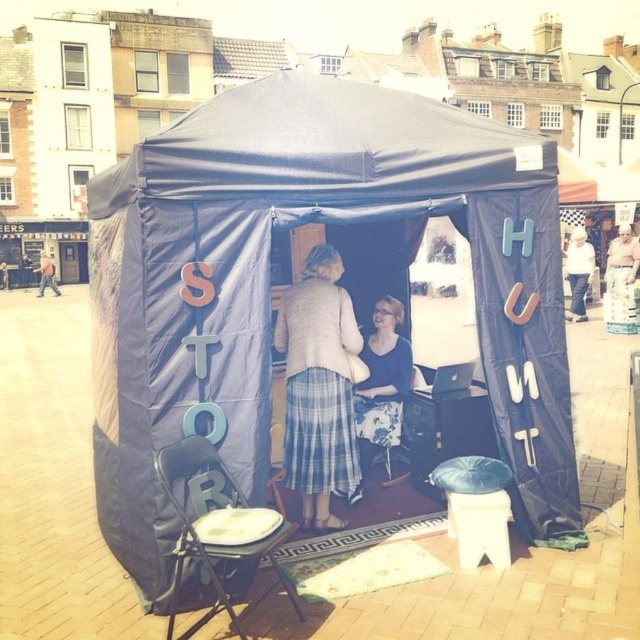
Question: From the image, what is the correct spatial relationship of dark blue leather stool at center in relation to matte black jacket at left?

Choices:
 (A) left
 (B) right

Answer: (B)

Question: Does white cotton shirt at upper right have a larger size compared to matte black jacket at left?

Choices:
 (A) no
 (B) yes

Answer: (A)

Question: Which point is closer to the camera taking this photo?

Choices:
 (A) (467, 474)
 (B) (317, 266)

Answer: (A)

Question: Considering the real-world distances, which object is farthest from the white cotton shirt at upper right?

Choices:
 (A) blue fabric tent at center
 (B) matte black jacket at left
 (C) plaid skirt at center
 (D) dark blue leather stool at center

Answer: (B)

Question: Where is blue fabric tent at center located in relation to dark blue leather stool at center in the image?

Choices:
 (A) below
 (B) above

Answer: (B)

Question: Based on their relative distances, which object is nearer to the dark blue leather stool at center?

Choices:
 (A) white cotton shirt at upper right
 (B) plaid skirt at center

Answer: (B)